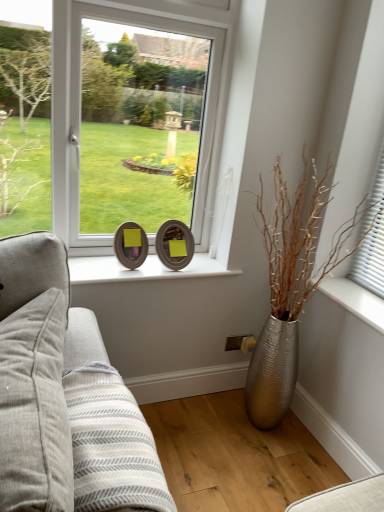
Find the location of `vacant area on top of silver metallic vase at right (from a real-world perspective)`. vacant area on top of silver metallic vase at right (from a real-world perspective) is located at coordinates (357, 298).